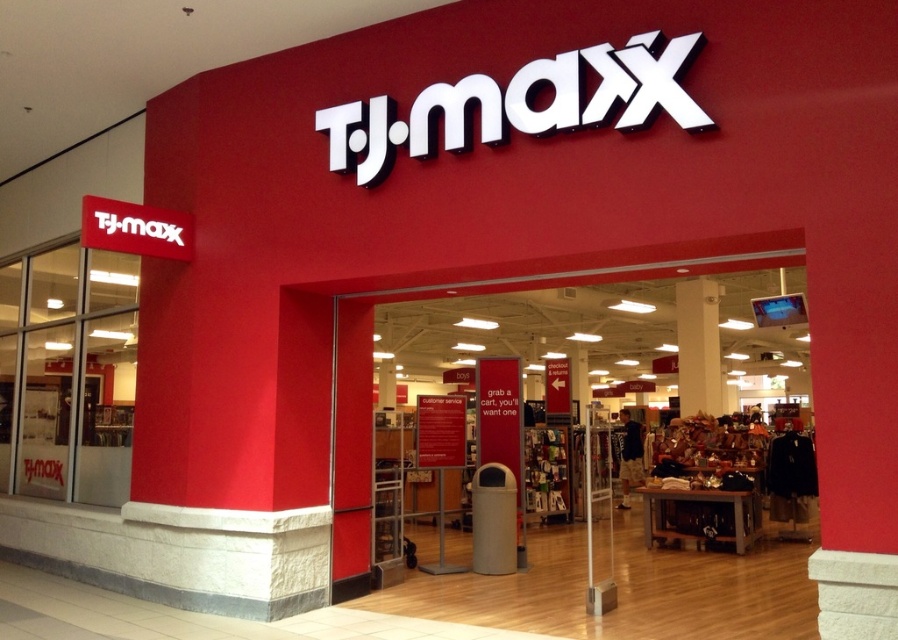
You are a customer entering the T.J.Maxx store and want to place your bag on the nearest surface. Which object should you choose between the wooden table at center and the white glossy pillar at upper center?

The wooden table at center is closer to the viewer than the white glossy pillar at upper center, so you should place your bag on the wooden table at center.

You are a customer entering the T.J.Maxx store and need to place a heavy bag on a surface. Which object between the wooden table at center and the white glossy pillar at upper center would be more suitable for placing your bag?

The wooden table at center is larger in size than the white glossy pillar at upper center, so the wooden table at center would be more suitable for placing your heavy bag as it provides a larger and more stable surface area.

You are standing at the entrance of the T.J.Maxx store and want to place a new display table. The store manager says the table must be placed exactly at point (577, 426). Where should you place the table?

Place the wooden table at center, as point (577, 426) indicates wooden table at center.